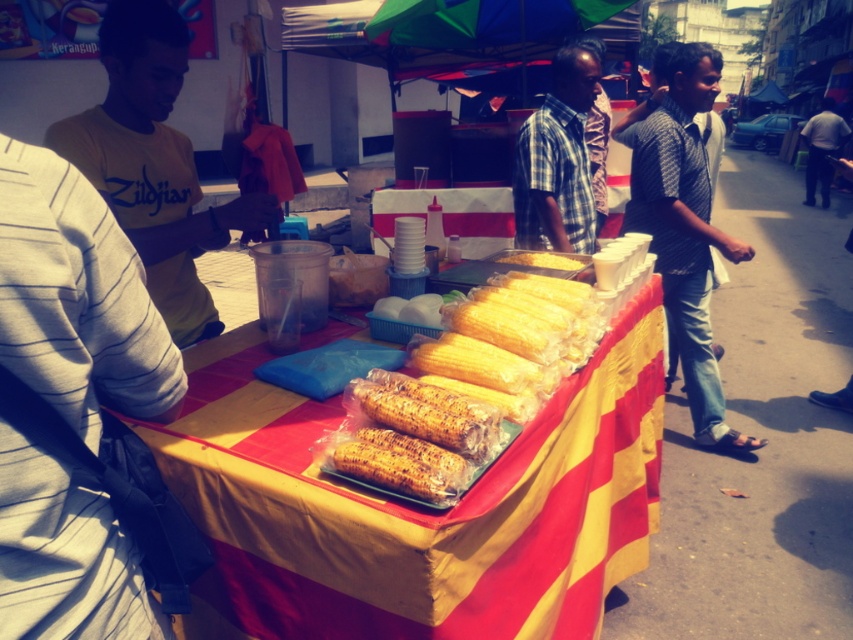
Which is below, yellow fabric table at center or dark gray pants at right?

yellow fabric table at center is below.

Who is shorter, yellow fabric table at center or dark gray pants at right?

yellow fabric table at center is shorter.

Image resolution: width=853 pixels, height=640 pixels. I want to click on yellow fabric table at center, so click(416, 508).

From the picture: Can you confirm if yellow fabric table at center is positioned above translucent plastic corn at center?

No.

This screenshot has height=640, width=853. What do you see at coordinates (416, 508) in the screenshot? I see `yellow fabric table at center` at bounding box center [416, 508].

Locate an element on the screen. This screenshot has width=853, height=640. yellow fabric table at center is located at coordinates (416, 508).

In the scene shown: Does patterned shirt at right lie in front of checkered fabric shirt at center?

Yes.

Between patterned shirt at right and checkered fabric shirt at center, which one has less height?

checkered fabric shirt at center is shorter.

Does point (685, 339) lie behind point (532, 129)?

Yes, it is behind point (532, 129).

This screenshot has width=853, height=640. What are the coordinates of `patterned shirt at right` in the screenshot? It's located at (683, 225).